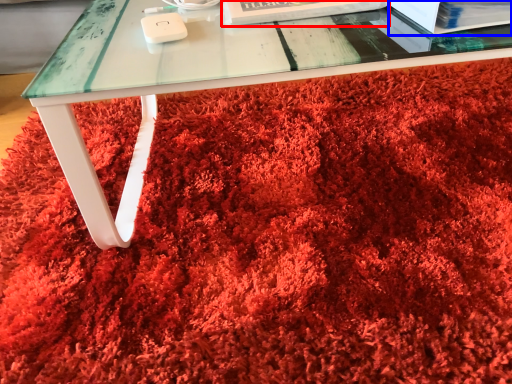
Question: Which of the following is the closest to the observer, paperback book (highlighted by a red box) or paperback book (highlighted by a blue box)?

Choices:
 (A) paperback book
 (B) paperback book

Answer: (B)